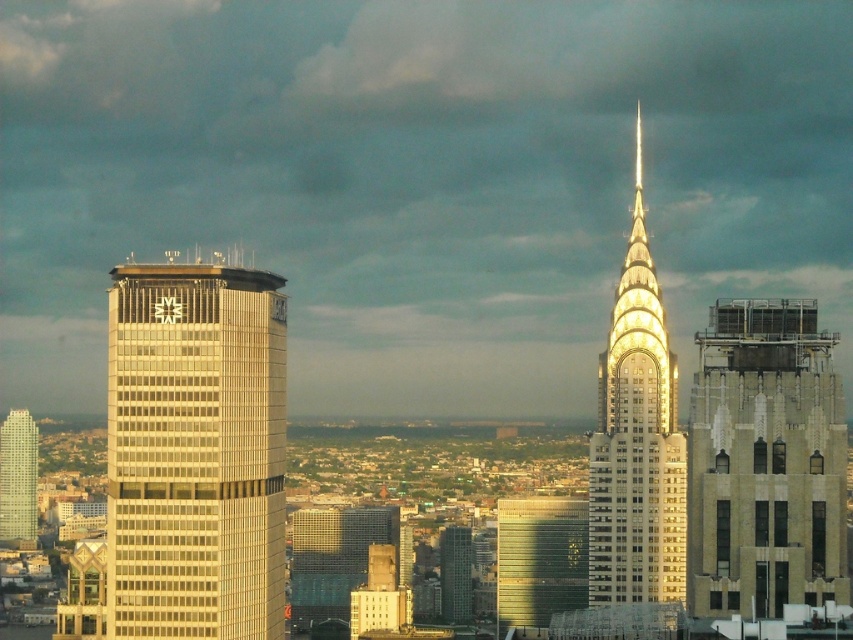
You are standing at the center of the city square and want to take a photo of the shiny gold skyscraper at center. Which direction should you face to ensure the skyscraper is in the frame?

The shiny gold skyscraper at center is located at point coordinates, so you should face the direction corresponding to those coordinates to capture it in your photo.

You are a city planner reviewing the city layout. You need to determine which of the two buildings, the silver glass skyscraper at left or the stone textured building at right, has a larger footprint. Based on the provided image, which one would you conclude?

The silver glass skyscraper at left is bigger than the stone textured building at right, so it has a larger footprint.